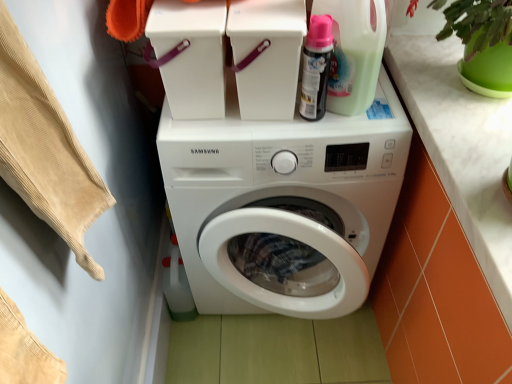
This screenshot has height=384, width=512. I want to click on vacant area to the right of matte black spray can at upper right, the first cleaning product viewed from the left, so click(x=371, y=115).